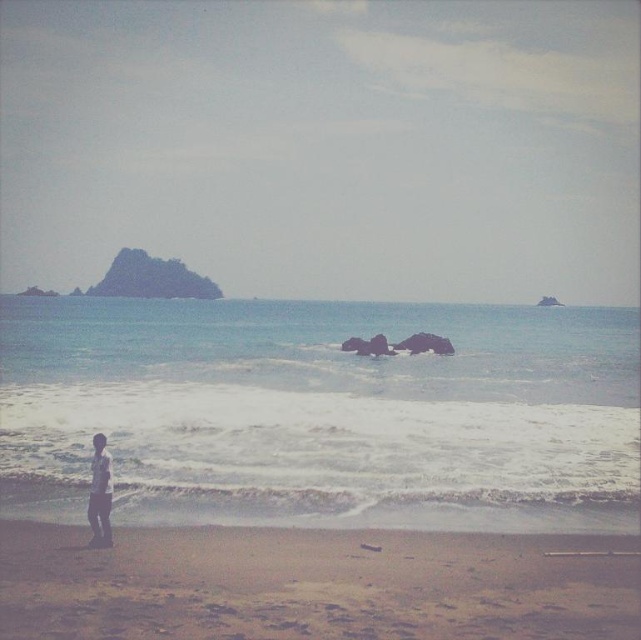
This screenshot has height=640, width=641. Describe the element at coordinates (320, 413) in the screenshot. I see `clear blue water at lower center` at that location.

Is point (624, 410) positioned after point (171, 544)?

Yes, it is behind point (171, 544).

Is point (317, 314) farther from viewer compared to point (440, 580)?

Yes.

Image resolution: width=641 pixels, height=640 pixels. Find the location of `clear blue water at lower center`. clear blue water at lower center is located at coordinates (320, 413).

Who is shorter, clear blue water at lower center or light blue denim jeans at lower left?

light blue denim jeans at lower left

Is point (338, 380) closer to camera compared to point (94, 448)?

That is False.

Where is `clear blue water at lower center`? clear blue water at lower center is located at coordinates (320, 413).

Is point (592, 566) less distant than point (104, 442)?

Yes, it is in front of point (104, 442).

Does brown sandy beach at lower center have a greater width compared to light blue denim jeans at lower left?

Yes.

Which is in front, point (265, 548) or point (106, 460)?

Positioned in front is point (106, 460).

Where is `brown sandy beach at lower center`? brown sandy beach at lower center is located at coordinates (313, 584).